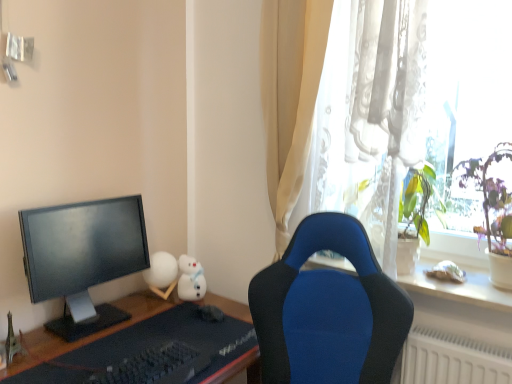
Identify the location of free point to the right of metallic silver eiffel tower at lower left, which is counted as the 4th toy, starting from the back. The image size is (512, 384). (50, 353).